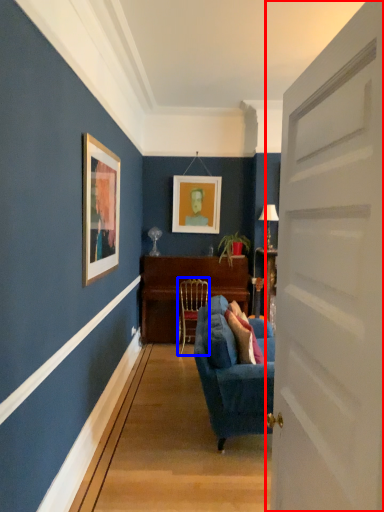
Question: Which point is closer to the camera, door (highlighted by a red box) or chair (highlighted by a blue box)?

Choices:
 (A) door
 (B) chair

Answer: (A)